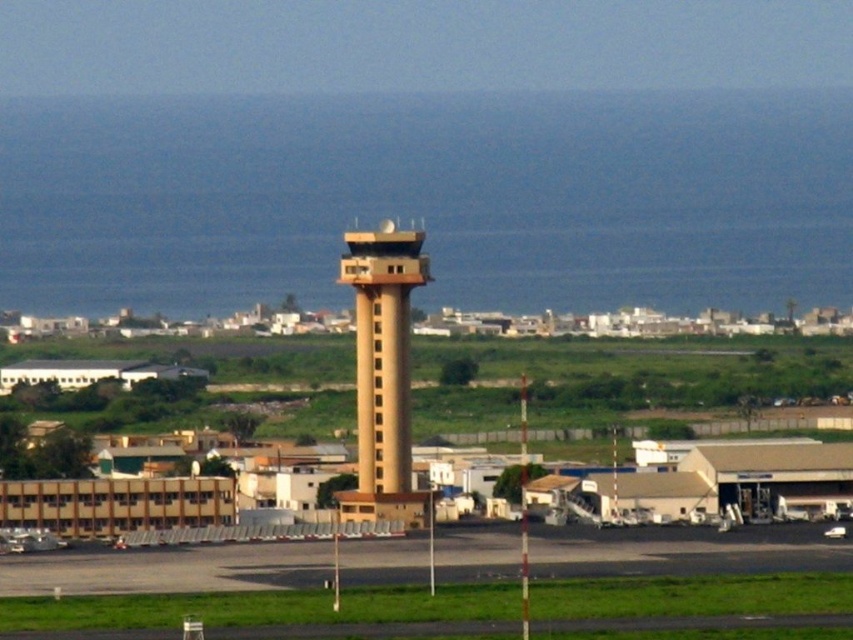
Question: Can you confirm if black asphalt runway at lower center is thinner than tan concrete control tower at center?

Choices:
 (A) no
 (B) yes

Answer: (A)

Question: Is black asphalt runway at lower center behind tan concrete control tower at center?

Choices:
 (A) no
 (B) yes

Answer: (B)

Question: Which point is closer to the camera taking this photo?

Choices:
 (A) (500, 570)
 (B) (404, 332)

Answer: (B)

Question: Can you confirm if black asphalt runway at lower center is smaller than tan concrete control tower at center?

Choices:
 (A) no
 (B) yes

Answer: (A)

Question: Which point is closer to the camera?

Choices:
 (A) black asphalt runway at lower center
 (B) tan concrete control tower at center

Answer: (B)